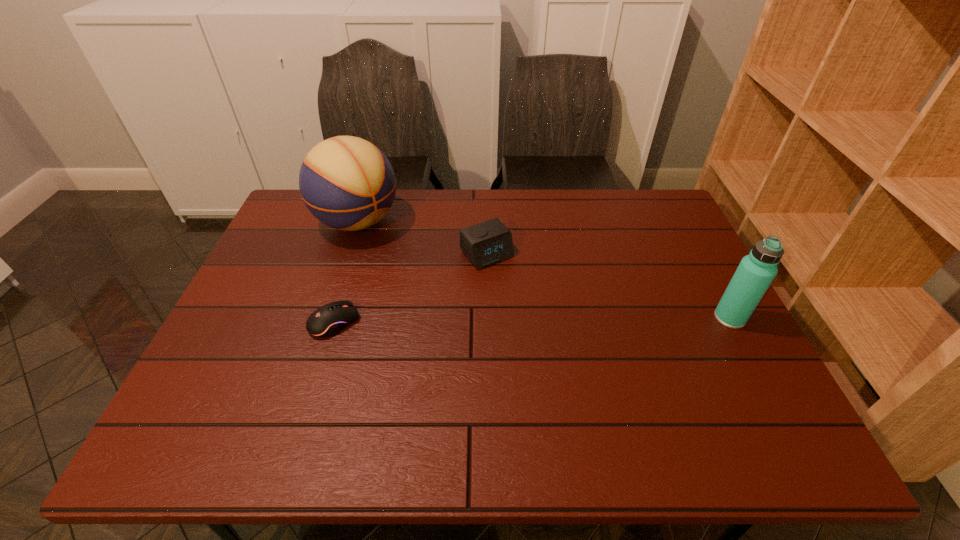
The height and width of the screenshot is (540, 960). I want to click on vacant space on the desktop that is between the shortest object and the rightmost object and is positioned on the front-facing side of the second shortest object, so click(544, 320).

You are a GUI agent. You are given a task and a screenshot of the screen. Output one action in this format:
    pyautogui.click(x=<x>, y=<y>)
    Task: Click on the vacant space on the desktop that is between the shortest object and the thermos bottle and is positioned on the patterned surface of the basketball
    Image resolution: width=960 pixels, height=540 pixels.
    Given the screenshot: What is the action you would take?
    pyautogui.click(x=479, y=320)